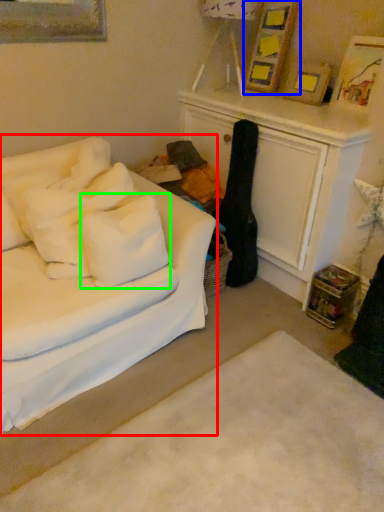
Question: Which is nearer to the studio couch (highlighted by a red box)? picture frame (highlighted by a blue box) or pillow (highlighted by a green box).

Choices:
 (A) picture frame
 (B) pillow

Answer: (B)